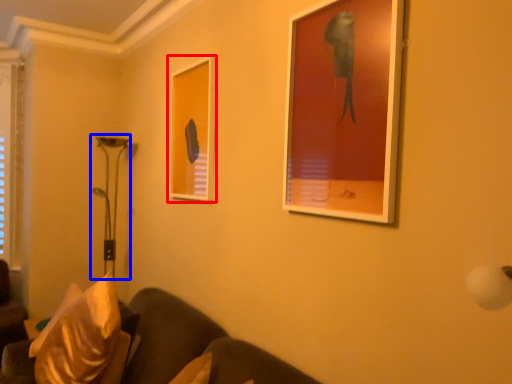
Question: Which of the following is the farthest to the observer, picture frame (highlighted by a red box) or table lamp (highlighted by a blue box)?

Choices:
 (A) picture frame
 (B) table lamp

Answer: (B)